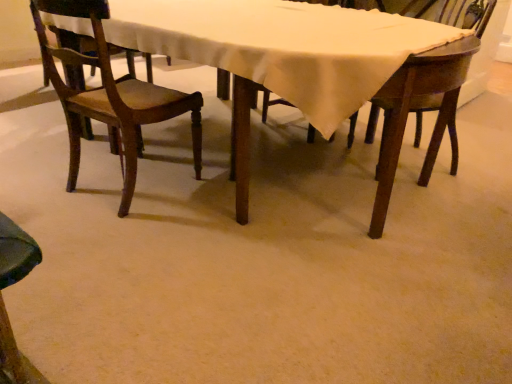
I want to click on free space on the front side of wooden chair at upper right, positioned as the 2th chair in left-to-right order, so click(x=438, y=198).